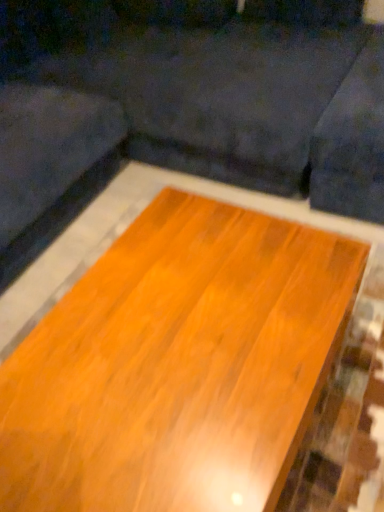
Where is `shiny wood table at center`? This screenshot has height=512, width=384. shiny wood table at center is located at coordinates (178, 365).

Image resolution: width=384 pixels, height=512 pixels. What do you see at coordinates (178, 365) in the screenshot?
I see `shiny wood table at center` at bounding box center [178, 365].

At what (x,y) coordinates should I click in order to perform the action: click on shiny wood table at center. Please return your answer as a coordinate pair (x, y). This screenshot has height=512, width=384. Looking at the image, I should click on (178, 365).